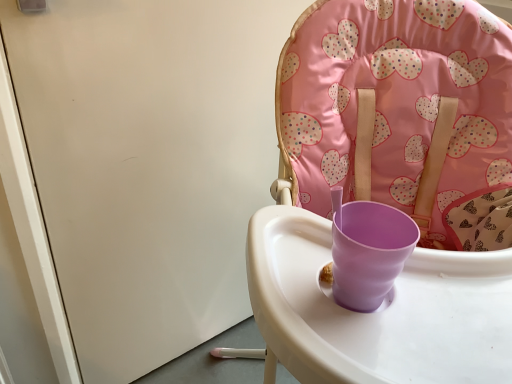
Question: From the image's perspective, relative to white glossy screen door at upper left, is matte plastic highchair at center above or below?

Choices:
 (A) below
 (B) above

Answer: (A)

Question: In the image, is matte plastic highchair at center positioned in front of or behind white glossy screen door at upper left?

Choices:
 (A) front
 (B) behind

Answer: (A)

Question: From their relative heights in the image, would you say matte plastic highchair at center is taller or shorter than white glossy screen door at upper left?

Choices:
 (A) short
 (B) tall

Answer: (B)

Question: Is white glossy screen door at upper left wider or thinner than matte plastic highchair at center?

Choices:
 (A) thin
 (B) wide

Answer: (A)

Question: From a real-world perspective, is white glossy screen door at upper left physically located above or below matte plastic highchair at center?

Choices:
 (A) below
 (B) above

Answer: (B)

Question: From the image's perspective, is white glossy screen door at upper left positioned above or below matte plastic highchair at center?

Choices:
 (A) below
 (B) above

Answer: (B)

Question: Is white glossy screen door at upper left inside the boundaries of matte plastic highchair at center, or outside?

Choices:
 (A) outside
 (B) inside

Answer: (A)